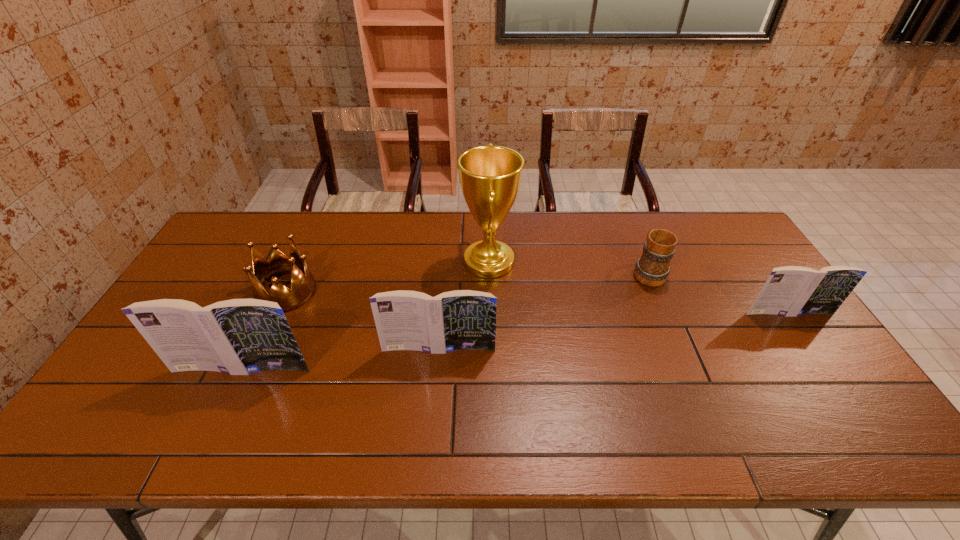
The height and width of the screenshot is (540, 960). Identify the location of vacant area between the crown and the award. (388, 277).

The height and width of the screenshot is (540, 960). Find the location of `vacant region between the second shortest book and the farthest book`. vacant region between the second shortest book and the farthest book is located at coordinates (613, 331).

This screenshot has height=540, width=960. I want to click on vacant space in between the nearest book and the tallest object, so click(x=366, y=315).

Locate an element on the screen. The image size is (960, 540). empty location between the crown and the rightmost book is located at coordinates (538, 302).

At what (x,y) coordinates should I click in order to perform the action: click on empty location between the award and the rightmost object. Please return your answer as a coordinate pair (x, y). Image resolution: width=960 pixels, height=540 pixels. Looking at the image, I should click on (638, 287).

Locate an element on the screen. This screenshot has height=540, width=960. free spot between the nearest object and the tallest object is located at coordinates (366, 315).

You are a GUI agent. You are given a task and a screenshot of the screen. Output one action in this format:
    pyautogui.click(x=<x>, y=<y>)
    Task: Click on the empty location between the farthest book and the third tallest object
    This screenshot has height=540, width=960.
    Given the screenshot: What is the action you would take?
    pyautogui.click(x=613, y=331)

Identify the location of blank region between the crown and the tallest object. (388, 277).

The width and height of the screenshot is (960, 540). I want to click on the closest object relative to the award, so click(x=461, y=319).

Identify which object is located as the second nearest to the leftmost book. Please provide its 2D coordinates. Your answer should be formatted as a tuple, i.e. [(x, y)], where the tuple contains the x and y coordinates of a point satisfying the conditions above.

[(461, 319)]